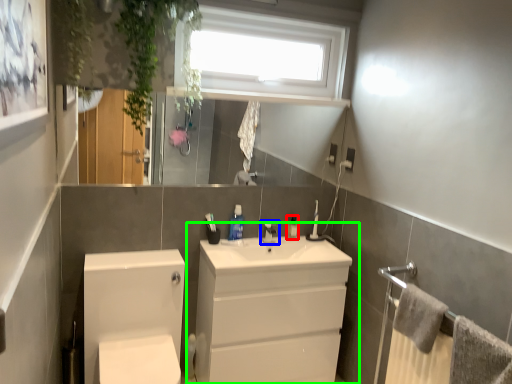
Question: Estimate the real-world distances between objects in this image. Which object is farther from toiletry (highlighted by a red box), tap (highlighted by a blue box) or bathroom cabinet (highlighted by a green box)?

Choices:
 (A) tap
 (B) bathroom cabinet

Answer: (B)